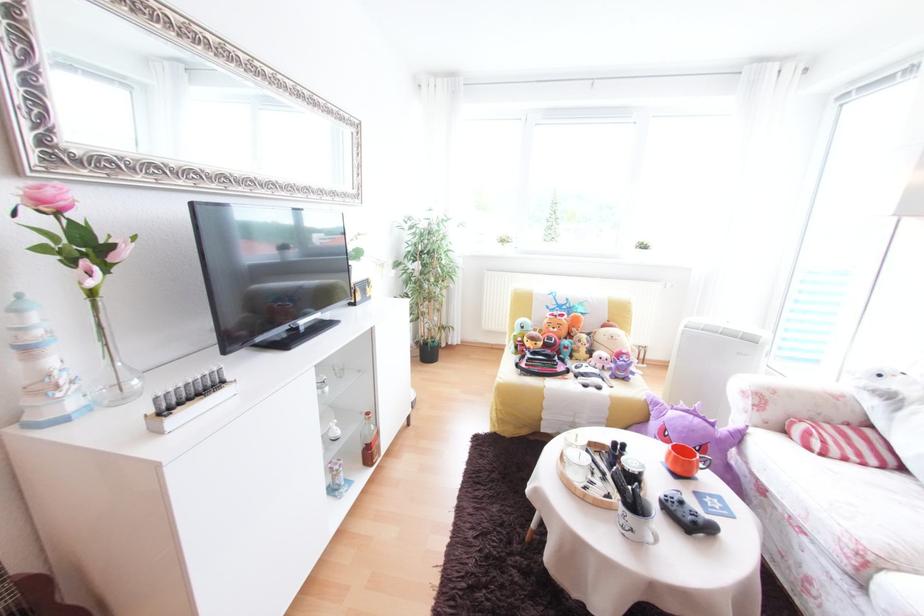
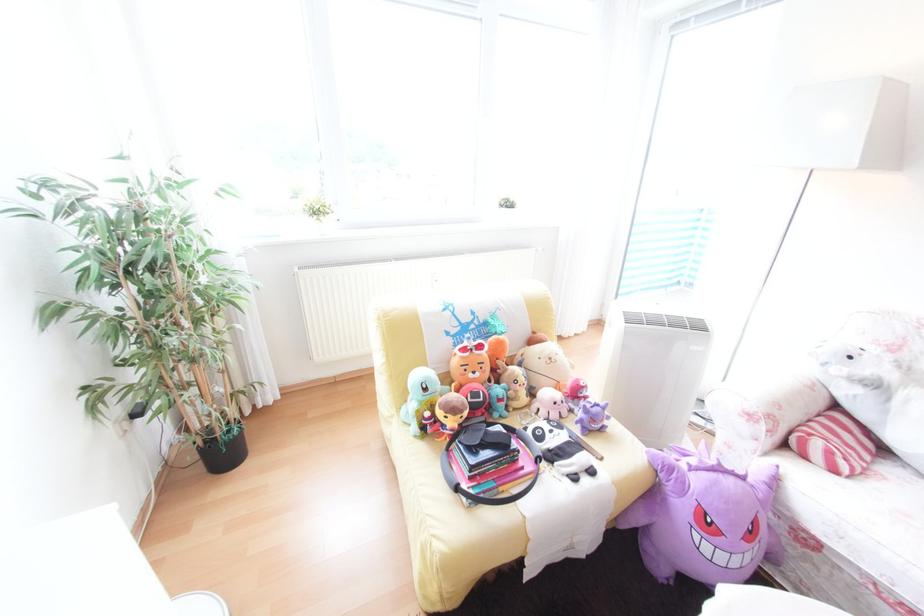
Locate, in the second image, the point that corresponds to point (603, 369) in the first image.

(568, 427)